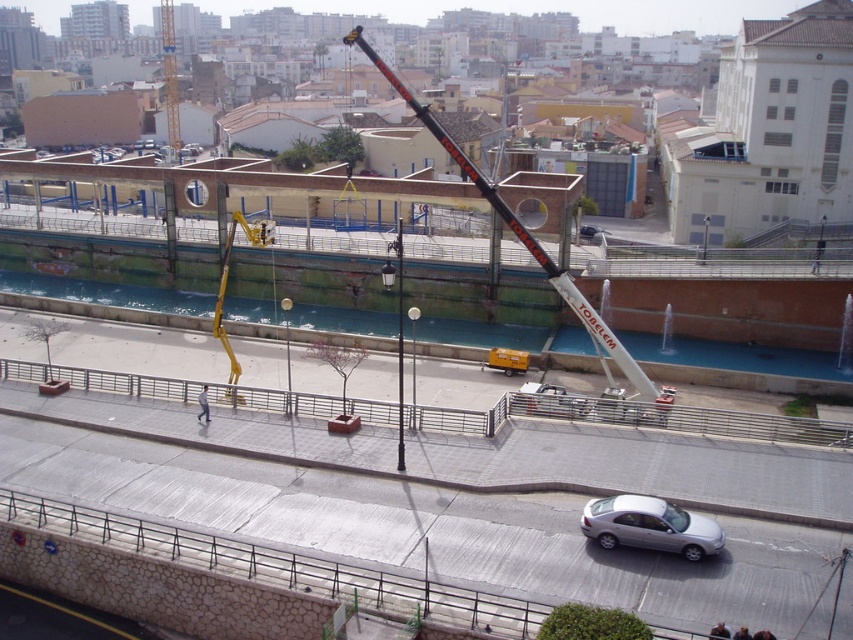
You are a safety inspector on the construction site. You need to ensure that the yellow metallic crane at upper left and the white fabric construction worker at center are positioned safely. Based on their heights, which object is more likely to block the view of the crane operator when looking towards the canal?

The yellow metallic crane at upper left is much taller than the white fabric construction worker at center, so the crane itself is more likely to block the view of the crane operator when looking towards the canal.

You are a city planner analyzing this construction site. You need to determine if the yellow metallic crane at upper left can be moved closer to the white fabric construction worker at center without obstructing the worker. Based on their sizes, can the crane be positioned closer?

The yellow metallic crane at upper left is bigger than the white fabric construction worker at center. Since the crane is larger, moving it closer might reduce the available space around the worker, potentially causing obstruction. Ensure there is enough space to avoid blocking the worker.

You are a delivery drone flying over an urban construction site. You need to drop off a package to the white fabric construction worker at center without hitting the black metallic crane at center. Is the path clear for the drone to deliver the package directly above the worker?

The black metallic crane at center is located above the white fabric construction worker at center, so the drone cannot safely fly directly above the worker without risking collision with the crane. The drone should find an alternative route around the crane to deliver the package safely.